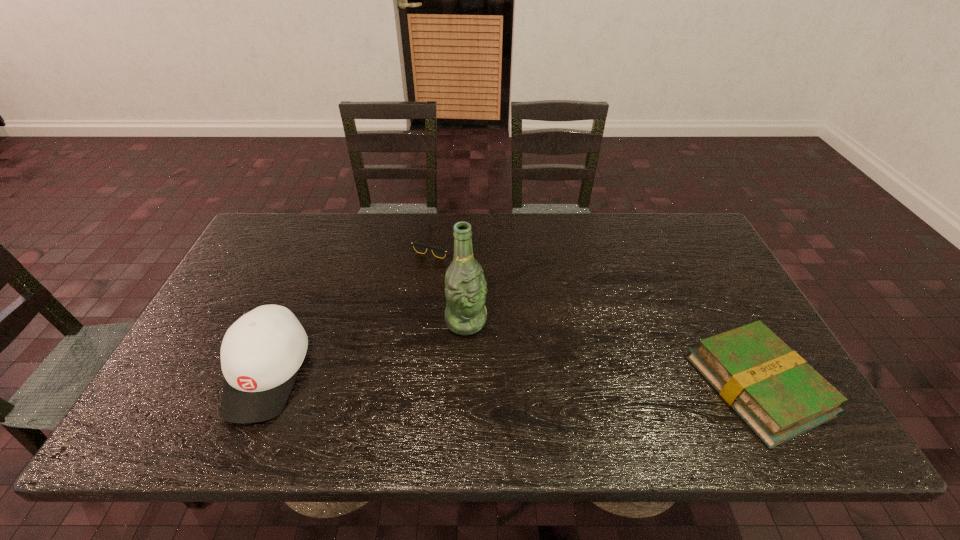
I want to click on vacant position located 0.060m on the surface of the beer bottle, so click(492, 350).

Find the location of a particular element. The width and height of the screenshot is (960, 540). free space located 0.110m on the lenses of the farthest object is located at coordinates click(442, 285).

Find the location of `free space located on the lenses of the farthest object`. free space located on the lenses of the farthest object is located at coordinates (442, 295).

The image size is (960, 540). Identify the location of vacant point located on the lenses of the farthest object. (446, 357).

Locate an element on the screen. The width and height of the screenshot is (960, 540). object at the far edge is located at coordinates (419, 247).

Locate an element on the screen. The image size is (960, 540). baseball cap that is at the near edge is located at coordinates (261, 353).

You are a GUI agent. You are given a task and a screenshot of the screen. Output one action in this format:
    pyautogui.click(x=<x>, y=<y>)
    Task: Click on the book present at the near edge
    
    Given the screenshot: What is the action you would take?
    pyautogui.click(x=774, y=390)

Where is `object present at the left edge`? The width and height of the screenshot is (960, 540). object present at the left edge is located at coordinates (261, 353).

What are the coordinates of `object at the right edge` in the screenshot? It's located at click(x=774, y=390).

At what (x,y) coordinates should I click in order to perform the action: click on object located in the near left corner section of the desktop. Please return your answer as a coordinate pair (x, y). The width and height of the screenshot is (960, 540). Looking at the image, I should click on (261, 353).